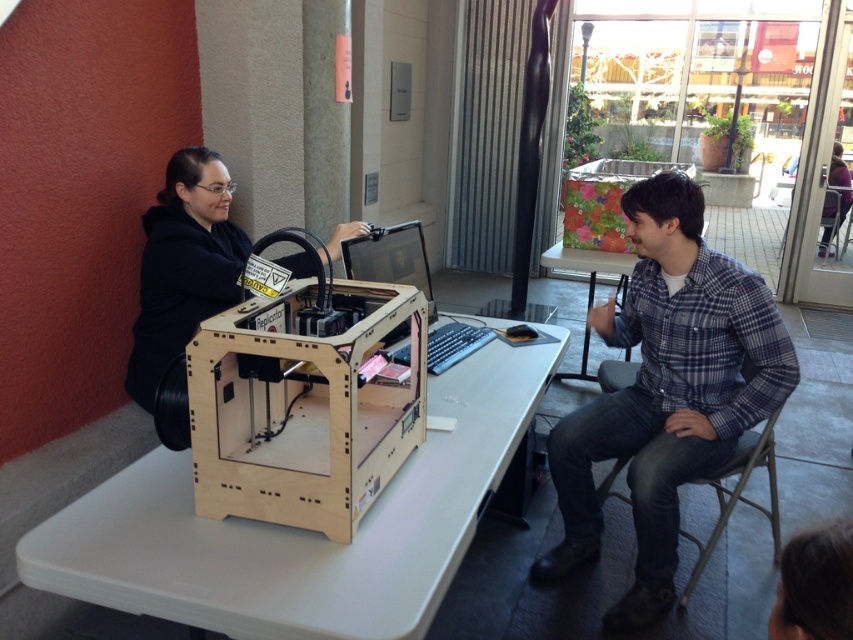
You are a person who is 1.7 meters tall. You are standing in the scene and want to place a 0.5 meter tall sculpture on the light wood table at center. However, there is a plaid flannel shirt at right nearby. Considering the height of the table and the shirt, will the sculpture be visible above the shirt when placed on the table?

The light wood table at center has a lesser height compared to plaid flannel shirt at right. Since the table is shorter than the shirt, placing a 0.5 meter tall sculpture on it may not make it visible above the shirt unless the shirt is moved or adjusted.

You are organizing a workshop and need to place a large poster on the table. The poster is as big as the table. Will the poster fit entirely on the light wood table at center without overlapping the black matte 3d printer at left?

The light wood table at center is bigger than the black matte 3d printer at left. Since the poster is as big as the table, it should fit entirely on the table without overlapping the printer, as the table has enough space to accommodate the poster.

Based on the photo, you are a delivery person who just arrived with a new 3D printer that is 36 inches wide. You need to place it next to the existing black matte 3d printer at left on the light wood table at center. Is there enough space between them to fit the new printer without moving the existing one?

The distance between the light wood table at center and the black matte 3d printer at left is 34.12 inches. Since the new printer is 36 inches wide, there isn not enough space to place it next to the existing one without moving it.